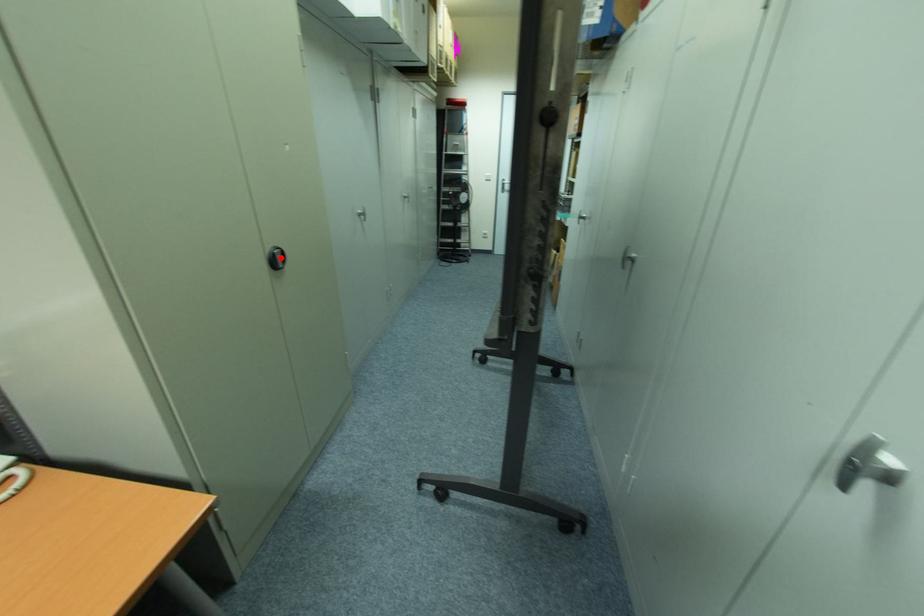
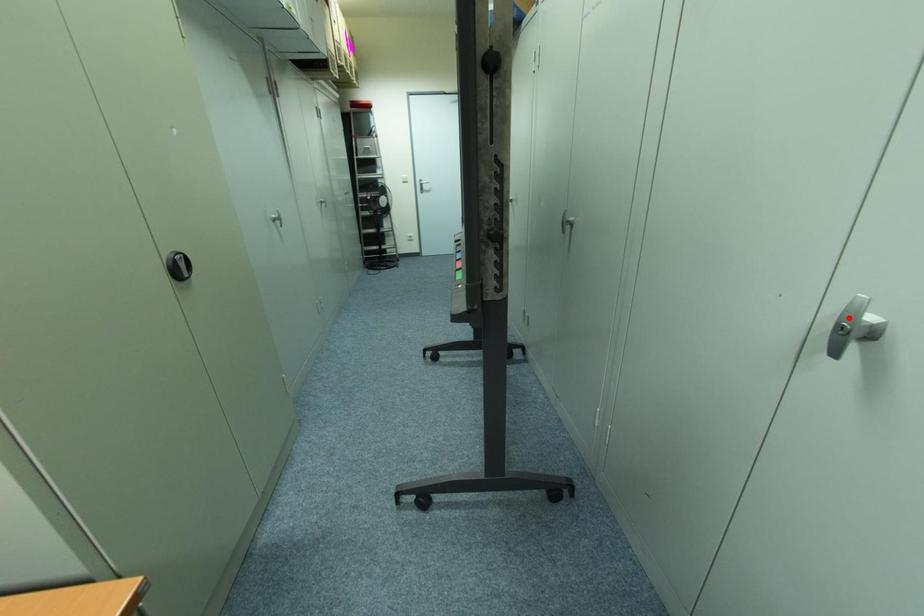
I am providing you with two images of the same scene from different viewpoints. A red point is marked on the first image and another point is marked on the second image. Are the points marked in image1 and image2 representing the same 3D position?

No